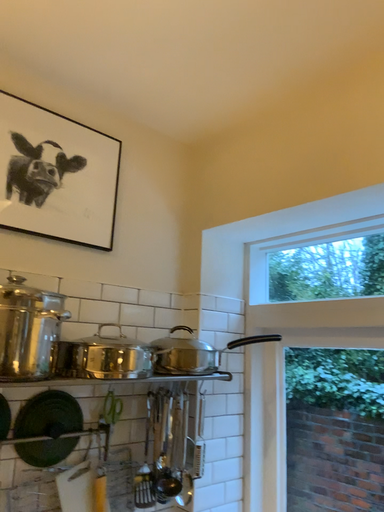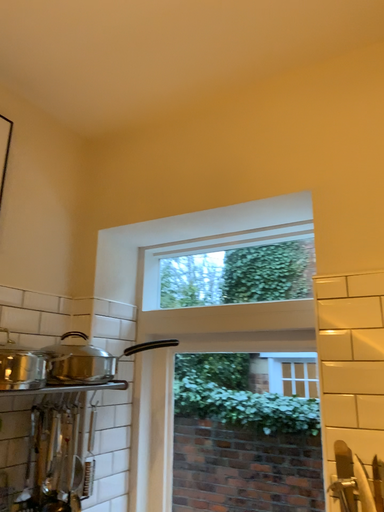
Question: How did the camera likely rotate when shooting the video?

Choices:
 (A) rotated right
 (B) rotated left

Answer: (A)